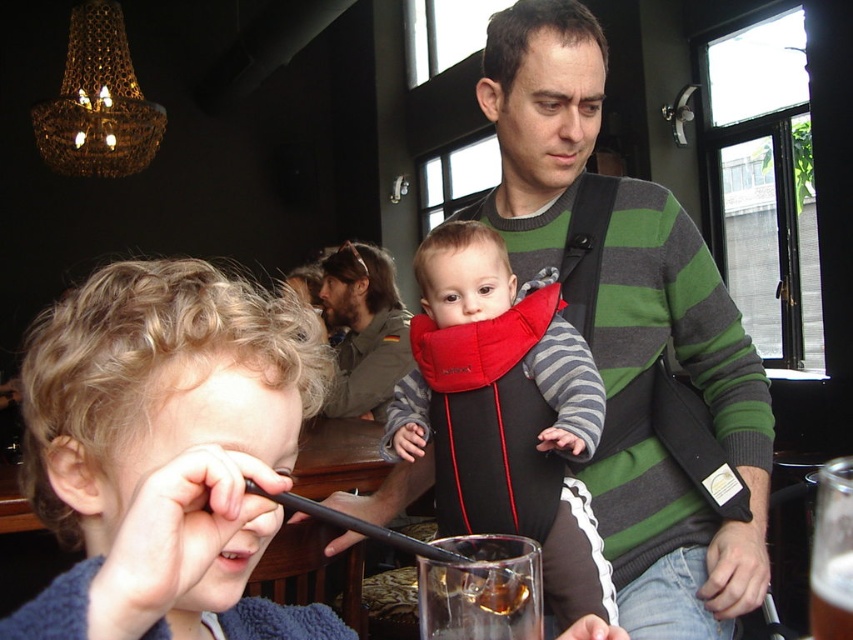
Is curly blonde hair at center taller than striped fabric baby carrier at center?

Incorrect, curly blonde hair at center's height is not larger of striped fabric baby carrier at center's.

Between curly blonde hair at center and striped fabric baby carrier at center, which one appears on the left side from the viewer's perspective?

curly blonde hair at center

Is point (33, 602) less distant than point (511, 401)?

Yes, it is in front of point (511, 401).

What are the coordinates of `curly blonde hair at center` in the screenshot? It's located at (166, 451).

Between striped fabric baby carrier at center and translucent amber liquid at lower center, which one is positioned lower?

translucent amber liquid at lower center is lower down.

Is striped fabric baby carrier at center to the left of translucent amber liquid at lower center from the viewer's perspective?

Indeed, striped fabric baby carrier at center is positioned on the left side of translucent amber liquid at lower center.

This screenshot has width=853, height=640. In order to click on striped fabric baby carrier at center in this screenshot , I will do `click(503, 412)`.

Based on the photo, does curly blonde hair at center appear on the right side of dark brown leather jacket at upper center?

Correct, you'll find curly blonde hair at center to the right of dark brown leather jacket at upper center.

Does curly blonde hair at center appear under dark brown leather jacket at upper center?

Indeed, curly blonde hair at center is positioned under dark brown leather jacket at upper center.

Find the location of a particular element. The height and width of the screenshot is (640, 853). curly blonde hair at center is located at coordinates [166, 451].

This screenshot has height=640, width=853. What are the coordinates of `curly blonde hair at center` in the screenshot? It's located at (166, 451).